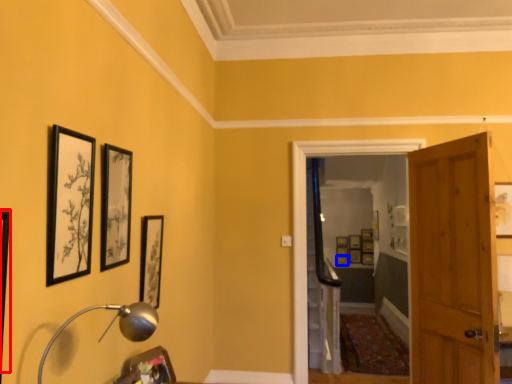
Question: Which object appears closest to the camera in this image, picture frame (highlighted by a red box) or picture frame (highlighted by a blue box)?

Choices:
 (A) picture frame
 (B) picture frame

Answer: (A)